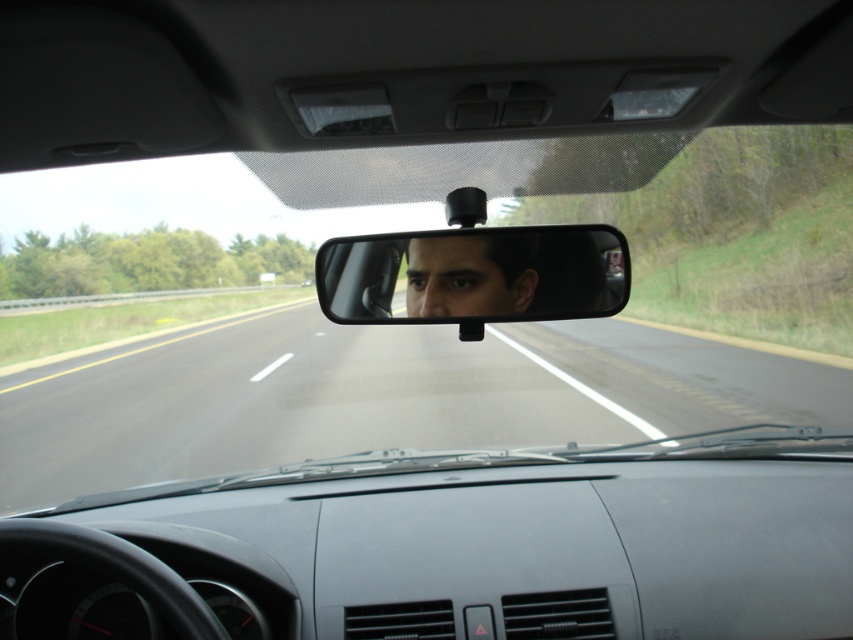
Question: Does clear plastic mirror at center appear on the right side of matte black face at center?

Choices:
 (A) no
 (B) yes

Answer: (B)

Question: Can you confirm if clear plastic mirror at center is positioned to the left of matte black face at center?

Choices:
 (A) yes
 (B) no

Answer: (B)

Question: Can you confirm if clear plastic mirror at center is wider than matte black face at center?

Choices:
 (A) yes
 (B) no

Answer: (A)

Question: Among these objects, which one is farthest from the camera?

Choices:
 (A) matte black face at center
 (B) clear plastic mirror at center

Answer: (A)

Question: Which object appears farthest from the camera in this image?

Choices:
 (A) clear plastic mirror at center
 (B) matte black face at center

Answer: (B)